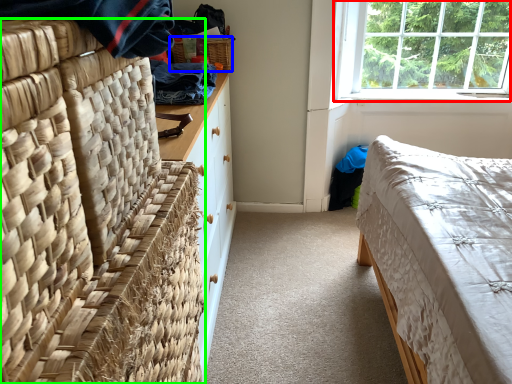
Question: Estimate the real-world distances between objects in this image. Which object is closer to window (highlighted by a red box), picnic basket (highlighted by a blue box) or furniture (highlighted by a green box)?

Choices:
 (A) picnic basket
 (B) furniture

Answer: (A)